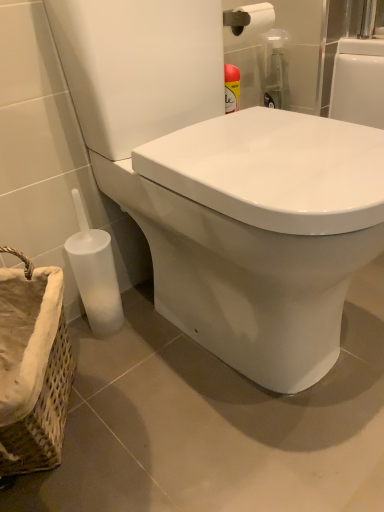
This screenshot has width=384, height=512. I want to click on empty space that is in between woven fabric basket at lower left and white matte toilet brush at lower left, so (x=106, y=378).